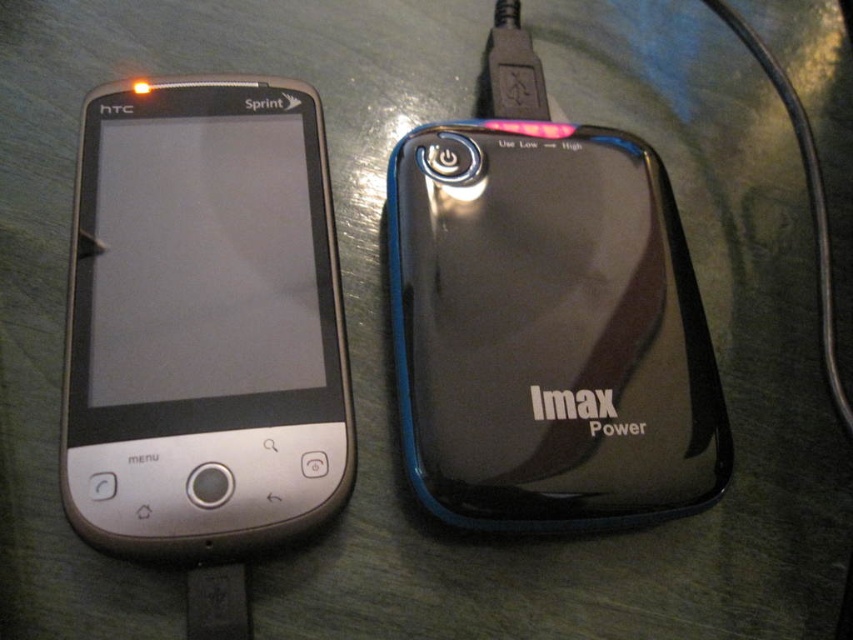
Question: Among these objects, which one is nearest to the camera?

Choices:
 (A) silver metallic smartphone at left
 (B) black glossy power bank at right

Answer: (A)

Question: Does silver metallic smartphone at left have a greater width compared to black glossy power bank at right?

Choices:
 (A) yes
 (B) no

Answer: (B)

Question: Which point appears farthest from the camera in this image?

Choices:
 (A) (216, 544)
 (B) (479, 220)

Answer: (B)

Question: Is silver metallic smartphone at left bigger than black glossy power bank at right?

Choices:
 (A) yes
 (B) no

Answer: (A)

Question: Which of the following is the farthest from the observer?

Choices:
 (A) (500, 412)
 (B) (181, 524)

Answer: (A)

Question: Does silver metallic smartphone at left have a smaller size compared to black glossy power bank at right?

Choices:
 (A) no
 (B) yes

Answer: (A)